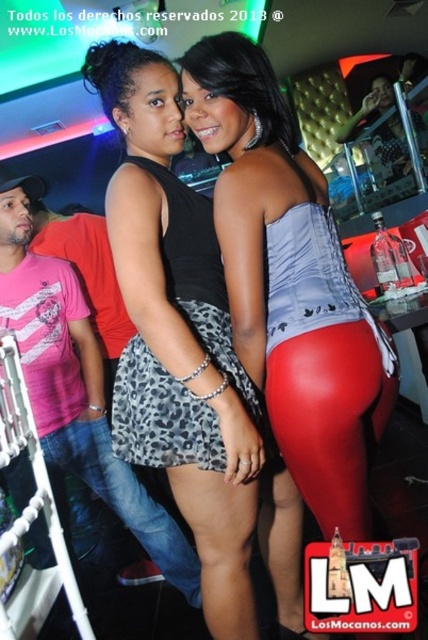
Question: Does leopard print dress at center have a greater width compared to leopard print fabric skirt at center?

Choices:
 (A) yes
 (B) no

Answer: (A)

Question: Which of the following is the farthest from the observer?

Choices:
 (A) leopard print fabric skirt at center
 (B) leopard print skirt at lower center

Answer: (B)

Question: Can you confirm if leopard print skirt at center is smaller than leopard print fabric skirt at center?

Choices:
 (A) no
 (B) yes

Answer: (A)

Question: Is pink striped t-shirt at left further to camera compared to leopard print skirt at lower center?

Choices:
 (A) no
 (B) yes

Answer: (A)

Question: Which point is closer to the camera?

Choices:
 (A) (259, 332)
 (B) (238, 362)

Answer: (A)

Question: Based on their relative distances, which object is nearer to the pink striped t-shirt at left?

Choices:
 (A) leopard print skirt at center
 (B) black leopard print dress at center
 (C) leopard print skirt at lower center
 (D) leopard print dress at center

Answer: (C)